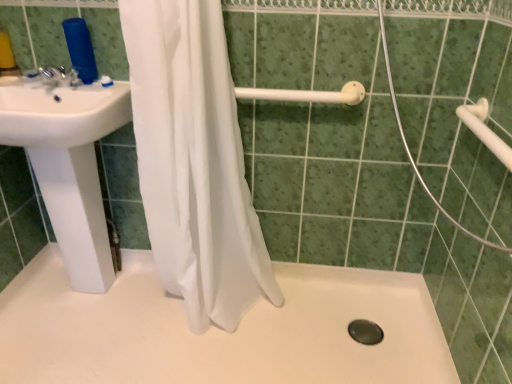
Locate an element on the screen. The image size is (512, 384). unoccupied space behind black rubber drain at bottom center is located at coordinates (352, 304).